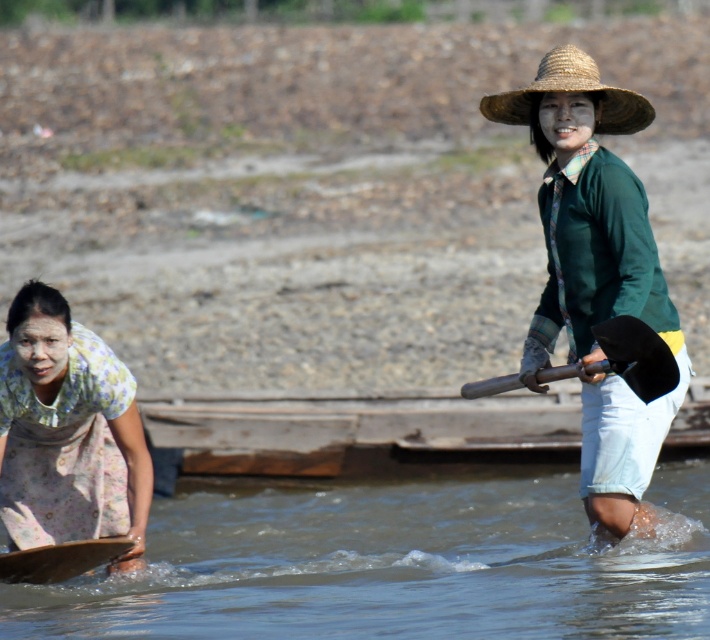
You are standing at the point labeled as point (395,566) in the image. Based on the scene description, what can you observe around you?

The point (395,566) corresponds to clear water at lower center, so you are standing in clear water at lower center.